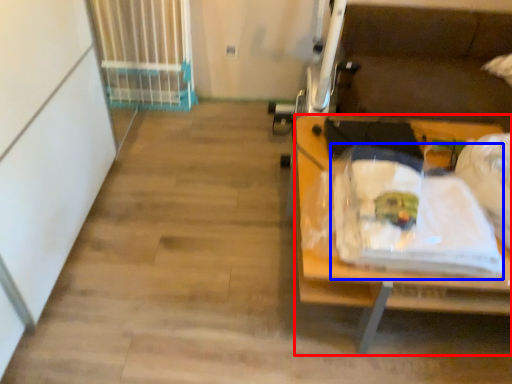
Question: Which object appears farthest to the camera in this image, desk (highlighted by a red box) or waste (highlighted by a blue box)?

Choices:
 (A) desk
 (B) waste

Answer: (A)